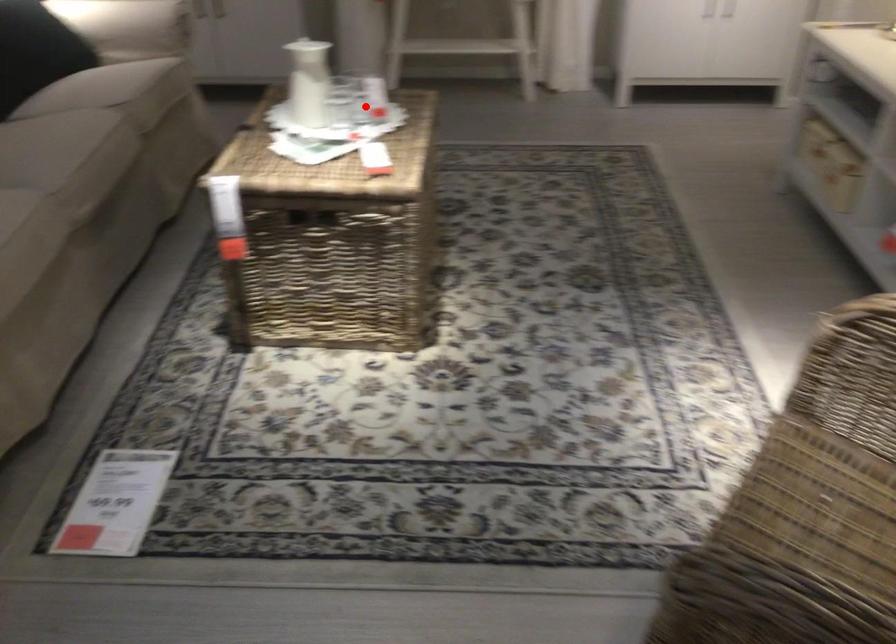
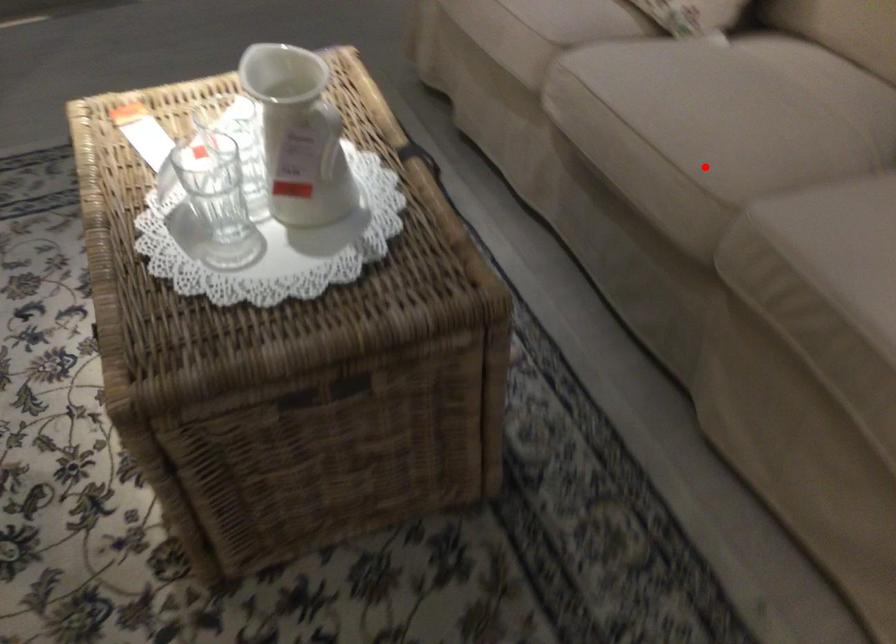
I am providing you with two images of the same scene from different viewpoints. A red point is marked on the first image and another point is marked on the second image. Do the highlighted points in image1 and image2 indicate the same real-world spot?

No